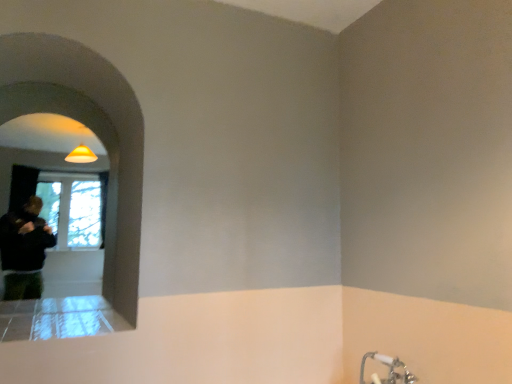
Question: From the image's perspective, is silver metallic faucet at lower right located above or below white smooth archway at upper left?

Choices:
 (A) above
 (B) below

Answer: (B)

Question: In the image, is silver metallic faucet at lower right on the left side or the right side of white smooth archway at upper left?

Choices:
 (A) left
 (B) right

Answer: (B)

Question: Relative to white smooth archway at upper left, is silver metallic faucet at lower right in front or behind?

Choices:
 (A) behind
 (B) front

Answer: (A)

Question: From a real-world perspective, is white smooth archway at upper left above or below silver metallic faucet at lower right?

Choices:
 (A) below
 (B) above

Answer: (B)

Question: Which is correct: white smooth archway at upper left is inside silver metallic faucet at lower right, or outside of it?

Choices:
 (A) inside
 (B) outside

Answer: (B)

Question: Is white smooth archway at upper left in front of or behind silver metallic faucet at lower right in the image?

Choices:
 (A) behind
 (B) front

Answer: (B)

Question: Does point (118, 236) appear closer or farther from the camera than point (390, 372)?

Choices:
 (A) farther
 (B) closer

Answer: (A)